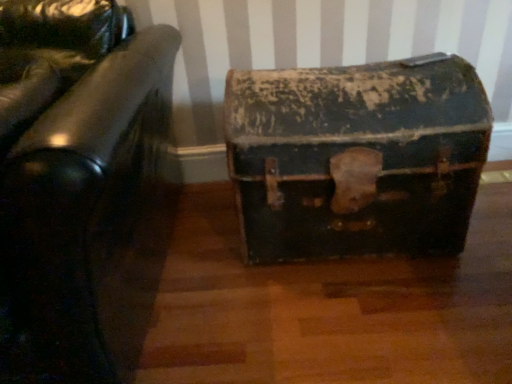
Question: Is rusty metal trunk at center situated inside rusty metal trunk at center or outside?

Choices:
 (A) outside
 (B) inside

Answer: (A)

Question: From a real-world perspective, is rusty metal trunk at center positioned above or below rusty metal trunk at center?

Choices:
 (A) below
 (B) above

Answer: (A)

Question: Relative to rusty metal trunk at center, is rusty metal trunk at center in front or behind?

Choices:
 (A) front
 (B) behind

Answer: (B)

Question: Is rusty metal trunk at center inside or outside of rusty metal trunk at center?

Choices:
 (A) outside
 (B) inside

Answer: (A)

Question: Considering their positions, is rusty metal trunk at center located in front of or behind rusty metal trunk at center?

Choices:
 (A) front
 (B) behind

Answer: (A)

Question: Is point (9, 67) closer or farther from the camera than point (454, 147)?

Choices:
 (A) closer
 (B) farther

Answer: (B)

Question: Based on their sizes in the image, would you say rusty metal trunk at center is bigger or smaller than rusty metal trunk at center?

Choices:
 (A) small
 (B) big

Answer: (B)